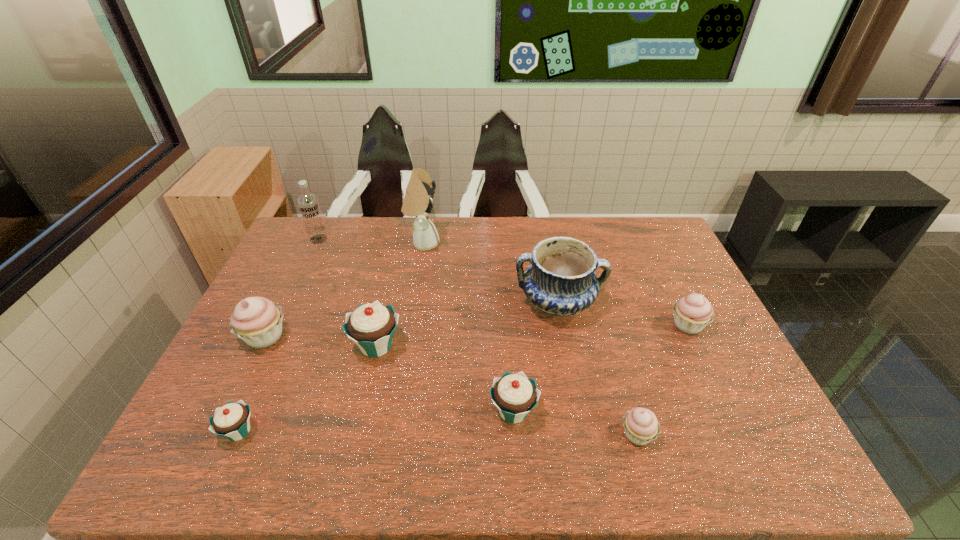
This screenshot has width=960, height=540. Find the location of `blank space located 0.100m on the left of the rightmost object`. blank space located 0.100m on the left of the rightmost object is located at coordinates (634, 325).

The image size is (960, 540). I want to click on vacant space situated 0.070m on the right of the fourth cupcake from left to right, so click(x=567, y=411).

I want to click on vacant space situated on the right of the leftmost teal cupcake, so click(305, 431).

Locate an element on the screen. Image resolution: width=960 pixels, height=540 pixels. vacant position located 0.190m on the right of the fifth cupcake from left to right is located at coordinates (737, 434).

Identify the location of doll located in the far edge section of the desktop. This screenshot has height=540, width=960. (418, 199).

Identify the location of vodka that is at the far edge. The height and width of the screenshot is (540, 960). (308, 203).

Locate an element on the screen. This screenshot has height=540, width=960. vodka present at the left edge is located at coordinates (308, 203).

Where is `object that is positioned at the right edge`? object that is positioned at the right edge is located at coordinates (693, 312).

Locate an element on the screen. object that is at the far left corner is located at coordinates (308, 203).

Locate an element on the screen. object situated at the near left corner is located at coordinates (232, 421).